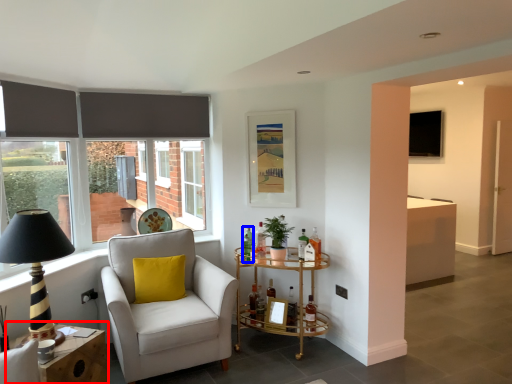
Question: Which object is closer to the camera taking this photo, table (highlighted by a red box) or bottle (highlighted by a blue box)?

Choices:
 (A) table
 (B) bottle

Answer: (A)